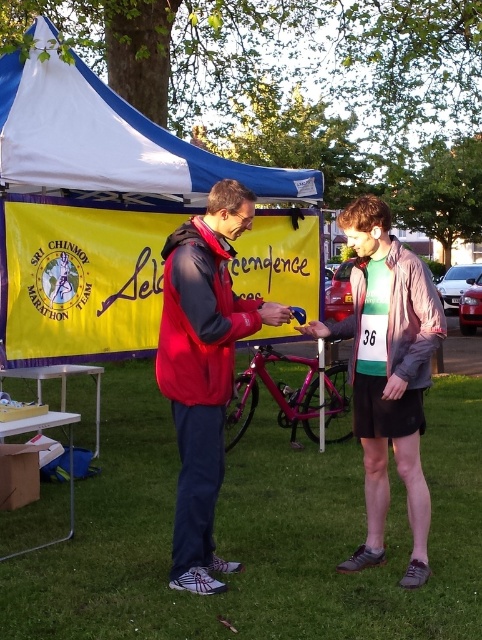
Who is more forward, (37, 524) or (197, 289)?

Point (197, 289)

Is green grass at center bigger than red fleece jacket at center?

Actually, green grass at center might be smaller than red fleece jacket at center.

Measure the distance between point (318, 452) and camera.

Point (318, 452) and camera are 6.87 meters apart from each other.

Where is `green grass at center`? green grass at center is located at coordinates (255, 534).

Can you confirm if green grass at center is positioned to the right of blue fabric canopy at upper left?

Incorrect, green grass at center is not on the right side of blue fabric canopy at upper left.

Between green grass at center and blue fabric canopy at upper left, which one has less height?

Standing shorter between the two is green grass at center.

At what (x,y) coordinates should I click in order to perform the action: click on green grass at center. Please return your answer as a coordinate pair (x, y). The height and width of the screenshot is (640, 482). Looking at the image, I should click on (255, 534).

You are a GUI agent. You are given a task and a screenshot of the screen. Output one action in this format:
    pyautogui.click(x=<x>, y=<y>)
    Task: Click on the green grass at center
    
    Given the screenshot: What is the action you would take?
    pyautogui.click(x=255, y=534)

Can you confirm if blue fabric canopy at upper left is positioned below red fleece jacket at center?

No.

Does blue fabric canopy at upper left appear over red fleece jacket at center?

Indeed, blue fabric canopy at upper left is positioned over red fleece jacket at center.

Which is behind, point (5, 161) or point (200, 413)?

Point (5, 161)

Locate an element on the screen. Image resolution: width=482 pixels, height=640 pixels. blue fabric canopy at upper left is located at coordinates (108, 140).